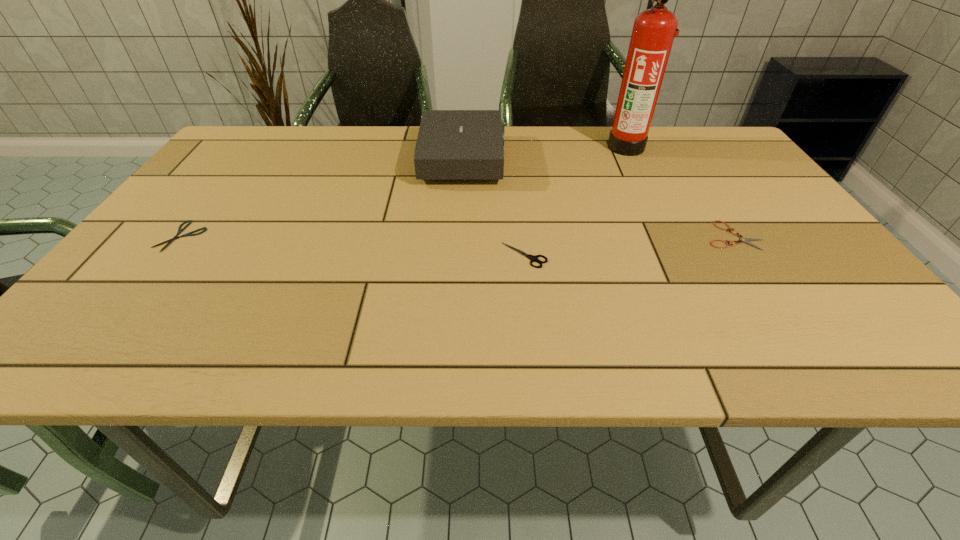
Where is `vacant area that lies between the third tallest object and the tallest object`? vacant area that lies between the third tallest object and the tallest object is located at coordinates (575, 201).

Where is `unoccupied position between the projector and the leftmost shears`? This screenshot has width=960, height=540. unoccupied position between the projector and the leftmost shears is located at coordinates (323, 198).

Where is `free point between the leftmost shears and the fire extinguisher`? The image size is (960, 540). free point between the leftmost shears and the fire extinguisher is located at coordinates (404, 191).

Find the location of `empty space between the rightmost object and the fourth object from left to right`. empty space between the rightmost object and the fourth object from left to right is located at coordinates (680, 191).

Find the location of a particular element. The image size is (960, 540). object that ranks as the third closest to the fourth shortest object is located at coordinates (746, 240).

The height and width of the screenshot is (540, 960). I want to click on object that is the fourth closest to the leftmost object, so click(x=746, y=240).

Locate which shears is the second closest to the leftmost shears. Please provide its 2D coordinates. Your answer should be formatted as a tuple, i.e. [(x, y)], where the tuple contains the x and y coordinates of a point satisfying the conditions above.

[(746, 240)]

You are a GUI agent. You are given a task and a screenshot of the screen. Output one action in this format:
    pyautogui.click(x=<x>, y=<y>)
    Task: Click on the shears that is the third closest to the fourth shortest object
    This screenshot has width=960, height=540.
    Given the screenshot: What is the action you would take?
    pyautogui.click(x=180, y=230)

Locate an element on the screen. The height and width of the screenshot is (540, 960). vacant space that satisfies the following two spatial constraints: 1. on the front-facing side of the second tallest object; 2. on the back side of the rightmost shears is located at coordinates (459, 235).

In order to click on vacant area in the image that satisfies the following two spatial constraints: 1. on the front-facing side of the rightmost object; 2. on the right side of the second tallest object in this screenshot , I will do `click(459, 235)`.